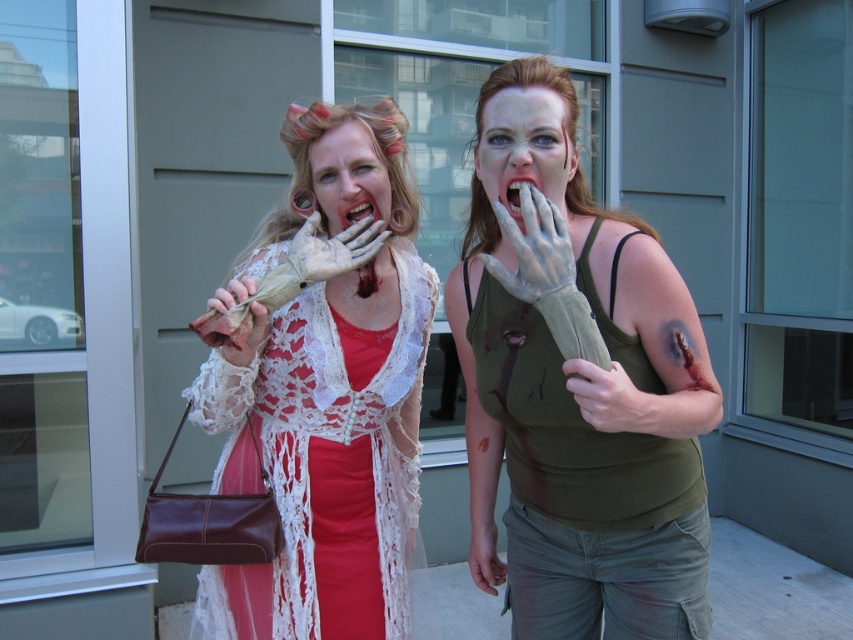
Question: Considering the relative positions of matte lace dress at center and matte white glove at center in the image provided, where is matte lace dress at center located with respect to matte white glove at center?

Choices:
 (A) above
 (B) below

Answer: (B)

Question: In this image, where is matte white lace at center located relative to matte green glove at center?

Choices:
 (A) left
 (B) right

Answer: (A)

Question: Which object is positioned closest to the matte green tank top at center?

Choices:
 (A) matte green glove at center
 (B) matte white lace at center
 (C) matte white glove at center

Answer: (A)

Question: Among these objects, which one is nearest to the camera?

Choices:
 (A) matte lace dress at center
 (B) matte white glove at center
 (C) matte green glove at center

Answer: (C)

Question: Which object is the closest to the matte white glove at center?

Choices:
 (A) matte green tank top at center
 (B) matte white lace at center

Answer: (B)

Question: Is matte gray face at center bigger than matte white glove at center?

Choices:
 (A) yes
 (B) no

Answer: (A)